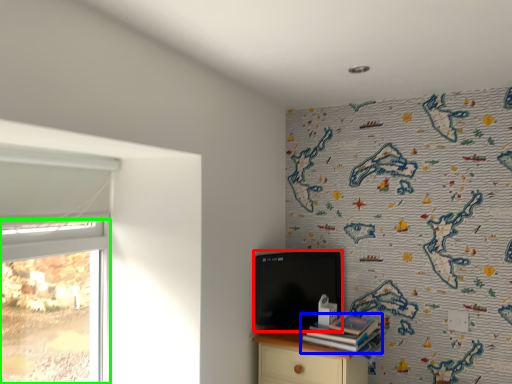
Question: Which object is the closest to the computer (highlighted by a red box)? Choose among these: book (highlighted by a blue box) or window (highlighted by a green box).

Choices:
 (A) book
 (B) window

Answer: (A)